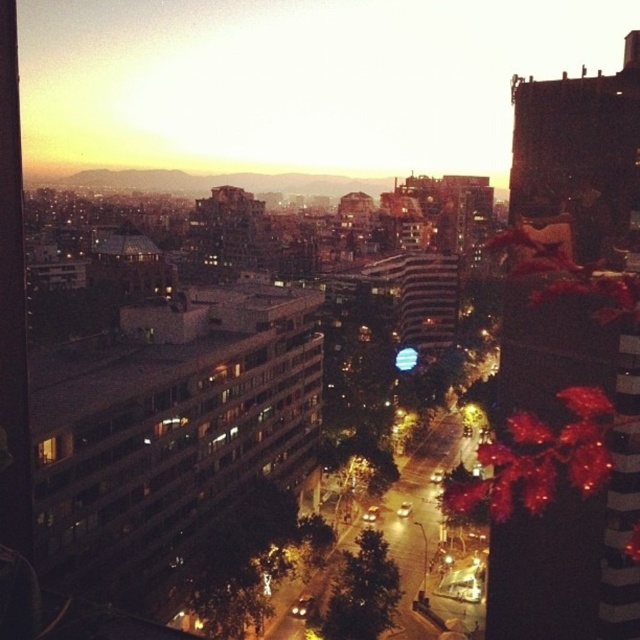
From the picture: You are a window installer assessing the space between the matte glass window at upper center and the shiny red leaves at right. Can you determine which object is wider?

The matte glass window at upper center is wider than the shiny red leaves at right according to the description.